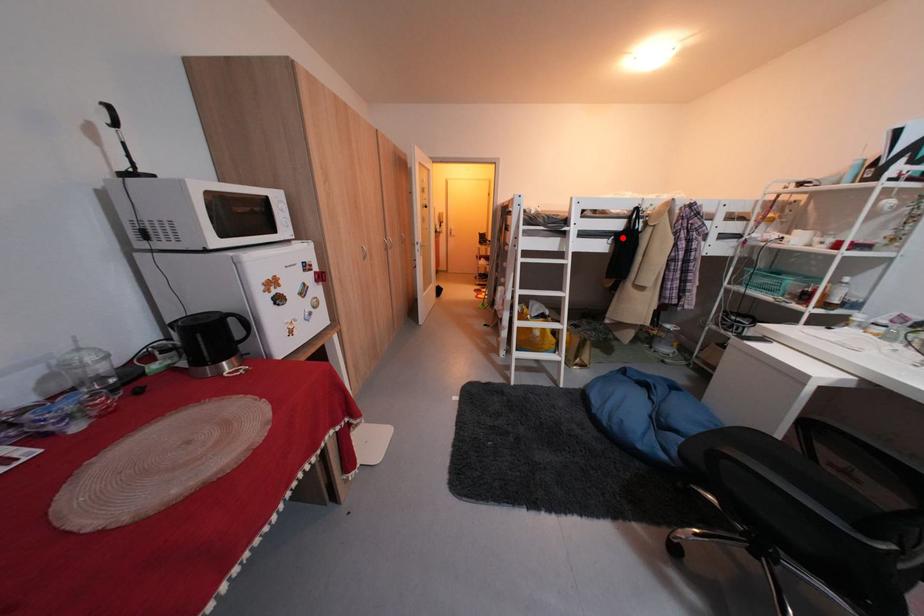
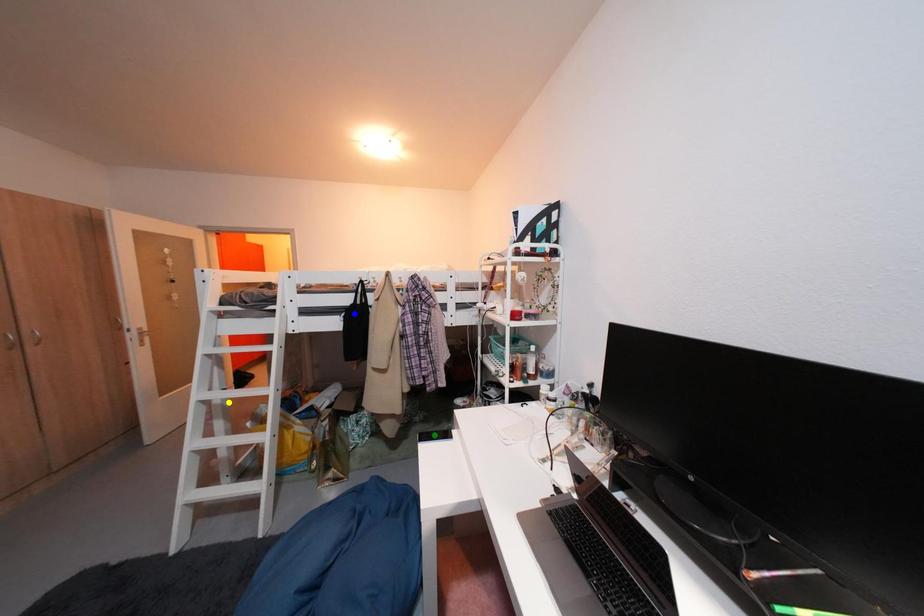
Question: I am providing you with two images of the same scene from different viewpoints. A red point is marked on the first image. You are given multiple points on the second image. In image 2, which mark is for the same physical point as the one in image 1?

Choices:
 (A) yellow point
 (B) green point
 (C) blue point

Answer: (C)